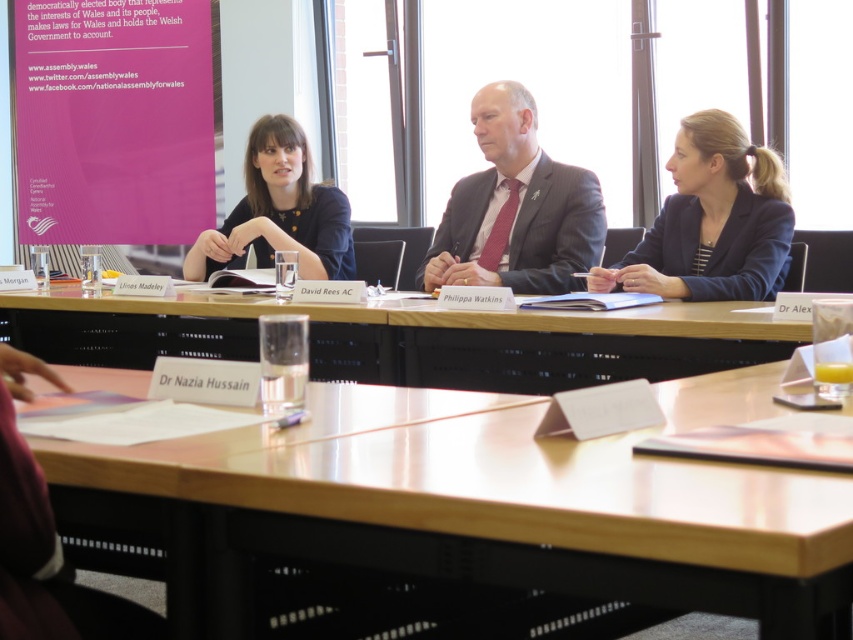
Question: Considering the real-world distances, which object is farthest from the matte black suit at center?

Choices:
 (A) wooden table at center
 (B) wooden table at lower left
 (C) matte black shirt at center
 (D) dark blue blazer at center

Answer: (B)

Question: Estimate the real-world distances between objects in this image. Which object is closer to the matte black shirt at center?

Choices:
 (A) matte black suit at center
 (B) wooden table at lower left
 (C) wooden table at center
 (D) dark blue blazer at center

Answer: (A)

Question: Observing the image, what is the correct spatial positioning of wooden table at center in reference to dark blue blazer at center?

Choices:
 (A) below
 (B) above

Answer: (A)

Question: Does dark blue blazer at center appear over matte black shirt at center?

Choices:
 (A) no
 (B) yes

Answer: (A)

Question: Which point is closer to the camera?

Choices:
 (A) (519, 115)
 (B) (381, 435)

Answer: (B)

Question: Is matte black suit at center bigger than matte black shirt at center?

Choices:
 (A) no
 (B) yes

Answer: (A)